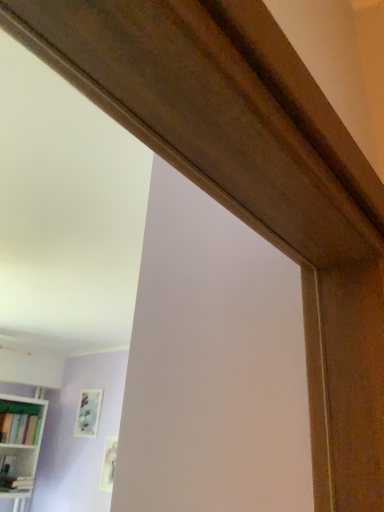
Question: Would you say white glossy bookcase at lower left contains matte white picture frame at lower center, the second picture frame in the left-to-right sequence?

Choices:
 (A) no
 (B) yes

Answer: (A)

Question: Considering the relative sizes of white glossy bookcase at lower left and matte white picture frame at lower center, which ranks as the first picture frame in front-to-back order, in the image provided, is white glossy bookcase at lower left taller than matte white picture frame at lower center, which ranks as the first picture frame in front-to-back order,?

Choices:
 (A) yes
 (B) no

Answer: (A)

Question: Does white glossy bookcase at lower left have a larger size compared to matte white picture frame at lower center, which is the second picture frame from back to front?

Choices:
 (A) no
 (B) yes

Answer: (B)

Question: Would you say white glossy bookcase at lower left is a long distance from matte white picture frame at lower center, the 1th picture frame in the right-to-left sequence?

Choices:
 (A) no
 (B) yes

Answer: (A)

Question: From the image's perspective, is white glossy bookcase at lower left located above matte white picture frame at lower center, the second picture frame in the left-to-right sequence?

Choices:
 (A) no
 (B) yes

Answer: (B)

Question: Choose the correct answer: Is matte wooden picture frame at upper left, acting as the first picture frame starting from the back, inside matte white picture frame at lower center, the 1th picture frame in the right-to-left sequence, or outside it?

Choices:
 (A) outside
 (B) inside

Answer: (A)

Question: Is matte wooden picture frame at upper left, the second picture frame in the front-to-back sequence, in front of or behind matte white picture frame at lower center, the 1th picture frame in the right-to-left sequence, in the image?

Choices:
 (A) front
 (B) behind

Answer: (B)

Question: From the image's perspective, is matte wooden picture frame at upper left, acting as the 2th picture frame starting from the right, located above or below matte white picture frame at lower center, the 1th picture frame in the right-to-left sequence?

Choices:
 (A) below
 (B) above

Answer: (B)

Question: Is point (81, 416) closer or farther from the camera than point (112, 437)?

Choices:
 (A) farther
 (B) closer

Answer: (A)

Question: From a real-world perspective, is matte green bookshelf at lower left above or below matte white picture frame at lower center, the second picture frame in the left-to-right sequence?

Choices:
 (A) below
 (B) above

Answer: (B)

Question: From the image's perspective, relative to matte white picture frame at lower center, the 1th picture frame in the right-to-left sequence, is matte green bookshelf at lower left above or below?

Choices:
 (A) below
 (B) above

Answer: (B)

Question: In terms of size, does matte green bookshelf at lower left appear bigger or smaller than matte white picture frame at lower center, which ranks as the first picture frame in front-to-back order?

Choices:
 (A) big
 (B) small

Answer: (A)

Question: In terms of width, does matte green bookshelf at lower left look wider or thinner when compared to matte white picture frame at lower center, which ranks as the first picture frame in front-to-back order?

Choices:
 (A) wide
 (B) thin

Answer: (A)

Question: In terms of size, does white glossy bookcase at lower left appear bigger or smaller than matte green bookshelf at lower left?

Choices:
 (A) small
 (B) big

Answer: (B)

Question: From their relative heights in the image, would you say white glossy bookcase at lower left is taller or shorter than matte green bookshelf at lower left?

Choices:
 (A) tall
 (B) short

Answer: (A)